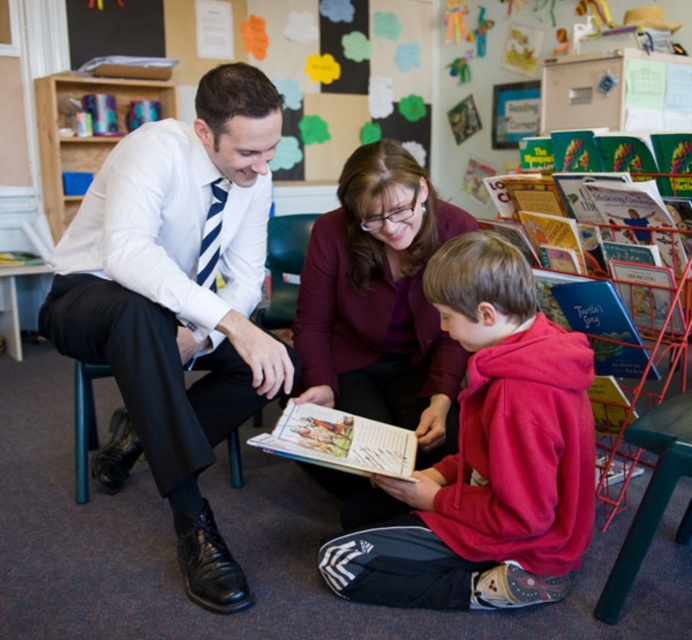
You are a photographer setting up for a group photo in this classroom scene. You need to ensure that the matte purple blazer at center and the colorful paper flowers at upper center are both visible in the shot. Based on their positions, which object should you focus on first to ensure both are in frame?

The matte purple blazer at center is in front of the colorful paper flowers at upper center. To ensure both are visible, focus on the matte purple blazer at center first, as it is closer to the camera, and adjust the frame to include the flowers behind it.

You are a teacher in a classroom. You need to place a new poster between the colorful paper flowers at upper center and the black fabric chair at left. Can you fit the poster if it is 3 meters wide?

The distance between the colorful paper flowers at upper center and the black fabric chair at left is 3.29 meters. Since the poster is 3 meters wide, it will fit within the space as it is shorter than the available distance.

You are standing in the classroom and want to move from the point at coordinates point (364, 248) to the point at coordinates point (408, 81). Which direction should you move?

You should move backward because point (364, 248) is in front of point (408, 81).